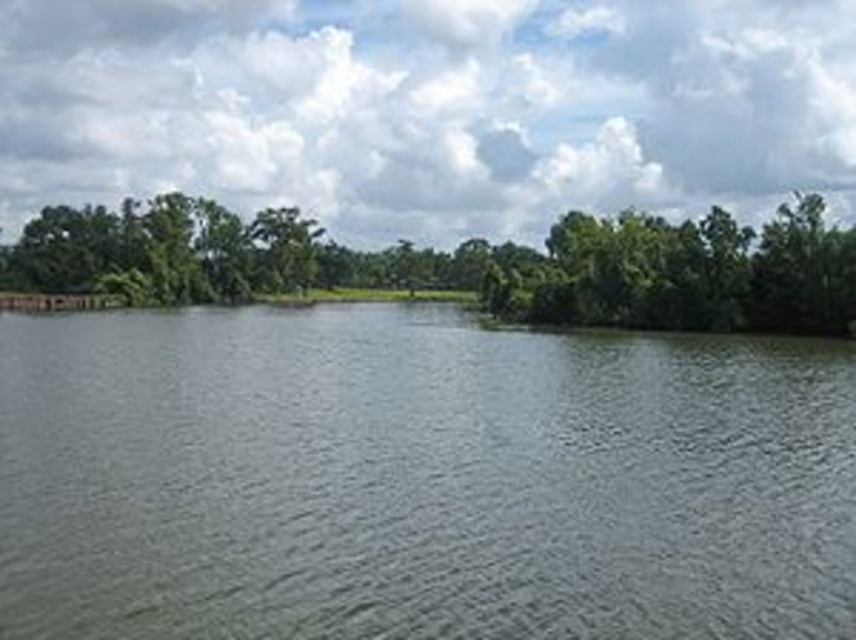
You are standing on a dock and want to throw a pebble into the gray smooth water at center. If the dock is 40 feet away from the water, will the pebble reach the water?

The gray smooth water at center and viewer are 50.33 feet apart from each other. Since the dock is only 40 feet away from the water, the pebble may not reach the water as the distance from the dock to the water is shorter than the total distance from the viewer to the water.

Consider the image. You are standing at the edge of the lake and see the gray smooth water at center and the green leafy trees at center. Which object is nearer to you?

The gray smooth water at center is closer to the viewer than the green leafy trees at center.

In the scene shown: You are standing on the lakeshore and notice the gray smooth water at center and the green leafy trees at center. Which object appears taller from your viewpoint?

The green leafy trees at center appear taller than the gray smooth water at center from your viewpoint.